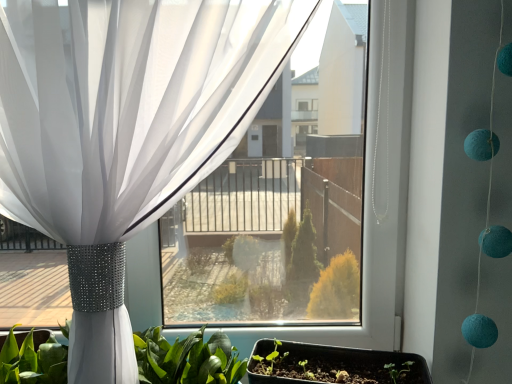
What do you see at coordinates (187, 359) in the screenshot? This screenshot has height=384, width=512. I see `green leafy plant at lower center` at bounding box center [187, 359].

The height and width of the screenshot is (384, 512). What do you see at coordinates (338, 366) in the screenshot?
I see `matte black tray at lower center` at bounding box center [338, 366].

At what (x,y) coordinates should I click in order to perform the action: click on green leafy plant at lower center. Please return your answer as a coordinate pair (x, y). This screenshot has height=384, width=512. Looking at the image, I should click on (187, 359).

Is white sheer curtain at upper left further to the viewer compared to matte black tray at lower center?

No, it is in front of matte black tray at lower center.

Is white sheer curtain at upper left oriented towards matte black tray at lower center?

No, white sheer curtain at upper left is not oriented towards matte black tray at lower center.

Which of these two, white sheer curtain at upper left or matte black tray at lower center, is smaller?

Smaller between the two is matte black tray at lower center.

Can you tell me how much white sheer curtain at upper left and matte black tray at lower center differ in facing direction?

The angular difference between white sheer curtain at upper left and matte black tray at lower center is 12.3 degrees.

Is point (380, 351) closer or farther from the camera than point (31, 169)?

Clearly, point (380, 351) is more distant from the camera than point (31, 169).

Find the location of `curtain above the matte black tray at lower center (from a real-world perspective)`. curtain above the matte black tray at lower center (from a real-world perspective) is located at coordinates (125, 130).

Between matte black tray at lower center and white sheer curtain at upper left, which one has larger width?

white sheer curtain at upper left is wider.

Consider the image. Can you confirm if matte black tray at lower center is smaller than white sheer curtain at upper left?

Yes, matte black tray at lower center is smaller than white sheer curtain at upper left.

Is green leafy plant at lower center positioned before white sheer curtain at upper left?

No, it is not.

Looking at this image, can you tell me how much green leafy plant at lower center and white sheer curtain at upper left differ in facing direction?

The angular difference between green leafy plant at lower center and white sheer curtain at upper left is 0.0293 degrees.

Is green leafy plant at lower center turned away from white sheer curtain at upper left?

Correct, green leafy plant at lower center is looking away from white sheer curtain at upper left.

From the image's perspective, does green leafy plant at lower center appear lower than white sheer curtain at upper left?

Yes, from the image's perspective, green leafy plant at lower center is beneath white sheer curtain at upper left.

How different are the orientations of matte black tray at lower center and green leafy plant at lower center in degrees?

The angle between the facing direction of matte black tray at lower center and the facing direction of green leafy plant at lower center is 12.4 degrees.

In the scene shown: From a real-world perspective, between matte black tray at lower center and green leafy plant at lower center, who is vertically higher?

green leafy plant at lower center is physically above.

Is matte black tray at lower center at the left side of green leafy plant at lower center?

No, matte black tray at lower center is not to the left of green leafy plant at lower center.

From the image's perspective, relative to green leafy plant at lower center, is matte black tray at lower center above or below?

matte black tray at lower center is below green leafy plant at lower center.

Does white sheer curtain at upper left have a lesser width compared to green leafy plant at lower center?

Incorrect, the width of white sheer curtain at upper left is not less than that of green leafy plant at lower center.

Would you say white sheer curtain at upper left is inside or outside green leafy plant at lower center?

white sheer curtain at upper left is spatially situated outside green leafy plant at lower center.

Does white sheer curtain at upper left have a larger size compared to green leafy plant at lower center?

Yes, white sheer curtain at upper left is bigger than green leafy plant at lower center.

Which is more to the left, white sheer curtain at upper left or green leafy plant at lower center?

From the viewer's perspective, green leafy plant at lower center appears more on the left side.

Consider the image. Is green leafy plant at lower center inside or outside of matte black tray at lower center?

green leafy plant at lower center lies outside matte black tray at lower center.

From the image's perspective, is green leafy plant at lower center over matte black tray at lower center?

Yes, from the image's perspective, green leafy plant at lower center is above matte black tray at lower center.

In terms of height, does green leafy plant at lower center look taller or shorter compared to matte black tray at lower center?

green leafy plant at lower center is taller than matte black tray at lower center.

Is green leafy plant at lower center positioned far away from matte black tray at lower center?

No, green leafy plant at lower center is in close proximity to matte black tray at lower center.

This screenshot has height=384, width=512. In order to click on curtain above the matte black tray at lower center (from the image's perspective) in this screenshot , I will do `click(125, 130)`.

This screenshot has width=512, height=384. I want to click on curtain above the matte black tray at lower center (from a real-world perspective), so click(x=125, y=130).

In the scene shown: Considering their positions, is white sheer curtain at upper left positioned closer to matte black tray at lower center than green leafy plant at lower center?

green leafy plant at lower center lies closer to matte black tray at lower center than the other object.

When comparing their distances from matte black tray at lower center, does green leafy plant at lower center or white sheer curtain at upper left seem further?

white sheer curtain at upper left.

Based on their spatial positions, is matte black tray at lower center or white sheer curtain at upper left further from green leafy plant at lower center?

white sheer curtain at upper left is further to green leafy plant at lower center.

Based on their spatial positions, is green leafy plant at lower center or matte black tray at lower center further from white sheer curtain at upper left?

matte black tray at lower center lies further to white sheer curtain at upper left than the other object.

Which object lies nearer to the anchor point green leafy plant at lower center, white sheer curtain at upper left or matte black tray at lower center?

The object closer to green leafy plant at lower center is matte black tray at lower center.

Estimate the real-world distances between objects in this image. Which object is closer to white sheer curtain at upper left, matte black tray at lower center or green leafy plant at lower center?

Based on the image, green leafy plant at lower center appears to be nearer to white sheer curtain at upper left.

This screenshot has width=512, height=384. What are the coordinates of `curtain between green leafy plant at lower center and matte black tray at lower center in the horizontal direction` in the screenshot? It's located at (125, 130).